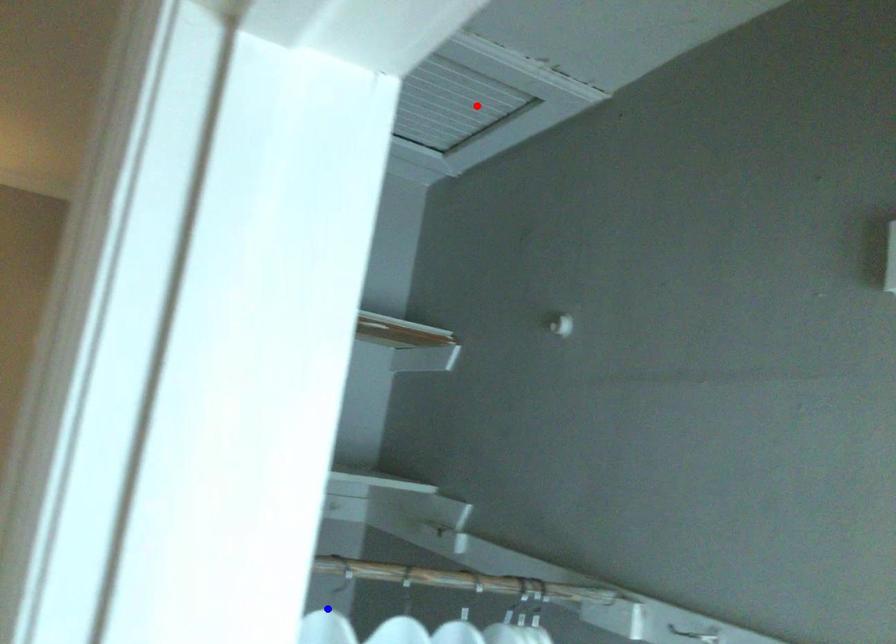
Question: Two points are marked on the image. Which point is closer to the camera?

Choices:
 (A) Blue point is closer.
 (B) Red point is closer.

Answer: (A)